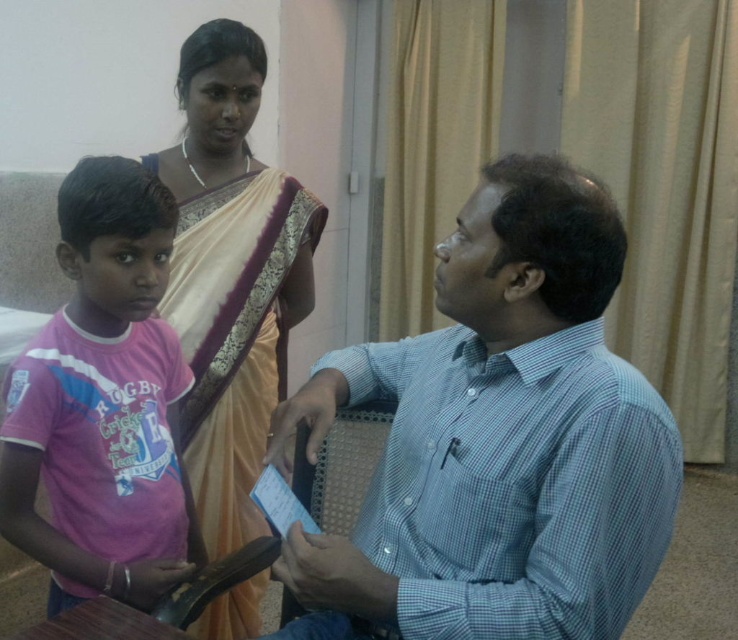
Does blue checkered shirt at right appear over beige silk saree at upper center?

Actually, blue checkered shirt at right is below beige silk saree at upper center.

Based on the photo, which is above, blue checkered shirt at right or beige silk saree at upper center?

beige silk saree at upper center is above.

Locate an element on the screen. blue checkered shirt at right is located at coordinates (496, 440).

The width and height of the screenshot is (738, 640). I want to click on blue checkered shirt at right, so click(496, 440).

Which is more to the right, pink jersey at left or beige silk saree at upper center?

Positioned to the right is beige silk saree at upper center.

Locate an element on the screen. This screenshot has width=738, height=640. pink jersey at left is located at coordinates (103, 403).

Does point (534, 310) come farther from viewer compared to point (72, 298)?

No, it is not.

Is blue checkered shirt at right shorter than pink jersey at left?

→ Correct, blue checkered shirt at right is not as tall as pink jersey at left.

Find the location of `blue checkered shirt at right`. blue checkered shirt at right is located at coordinates (496, 440).

Identify the location of blue checkered shirt at right. (496, 440).